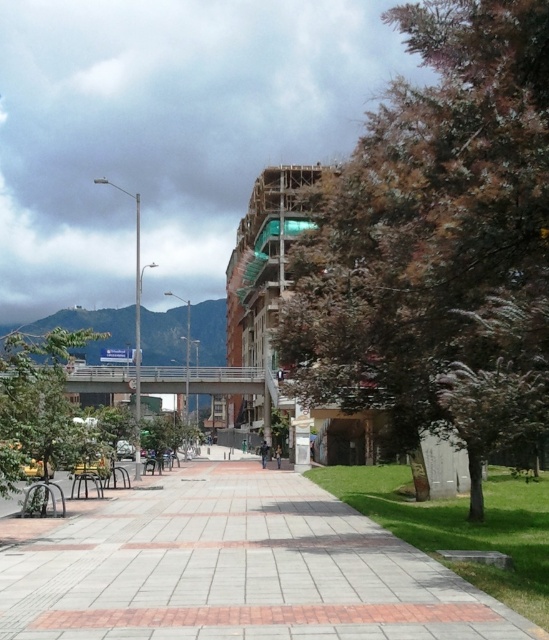
Question: From the image, what is the correct spatial relationship of brown textured tree at right in relation to brick paved walkway at center?

Choices:
 (A) right
 (B) left

Answer: (A)

Question: Among these objects, which one is farthest from the camera?

Choices:
 (A) brown textured tree at right
 (B) green leafy tree at lower left
 (C) brick paved walkway at center

Answer: (B)

Question: Which point appears farthest from the camera in this image?

Choices:
 (A) (7, 445)
 (B) (98, 504)
 (C) (77, 465)

Answer: (C)

Question: Based on their relative distances, which object is farther from the brick paved walkway at center?

Choices:
 (A) green leafy tree at lower left
 (B) brown textured tree at right
 (C) metallic park bench at lower left

Answer: (A)

Question: Is brown textured tree at right below metallic park bench at lower left?

Choices:
 (A) no
 (B) yes

Answer: (A)

Question: Does brown textured tree at right appear over green leafy tree at lower left?

Choices:
 (A) yes
 (B) no

Answer: (A)